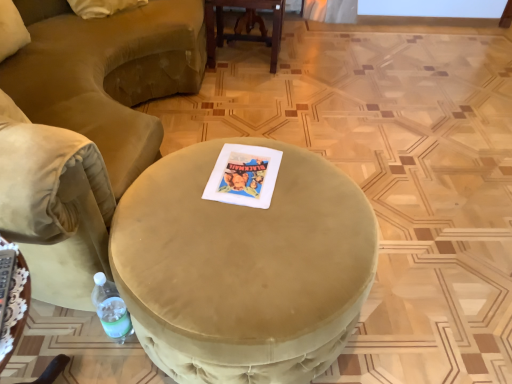
This screenshot has width=512, height=384. Identify the location of vacant area in front of translucent plastic bottle at lower left. (112, 365).